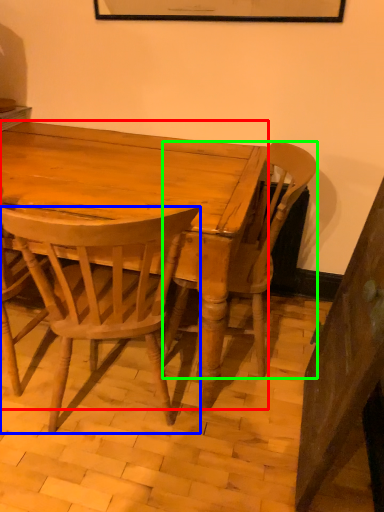
Question: Which is farther away from desk (highlighted by a red box)? chair (highlighted by a blue box) or chair (highlighted by a green box)?

Choices:
 (A) chair
 (B) chair

Answer: (B)